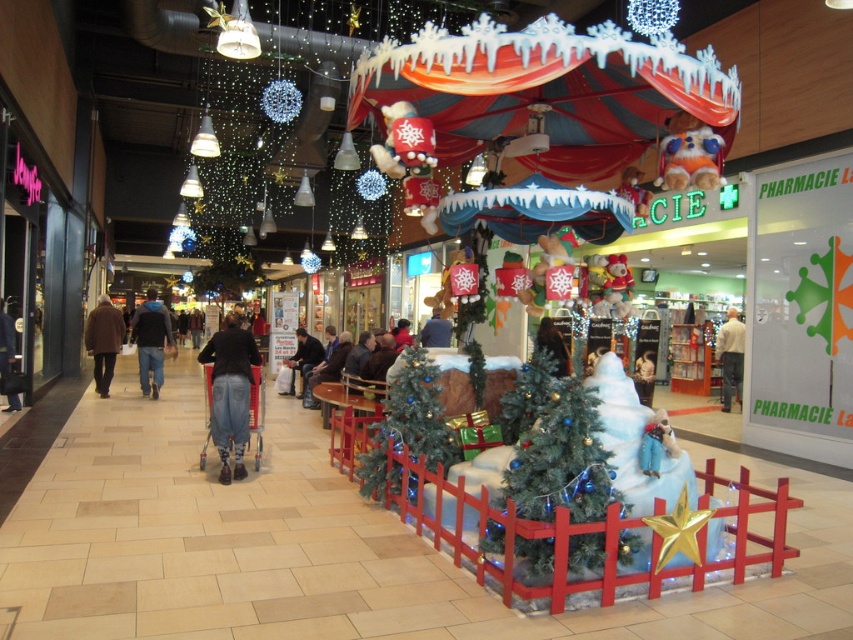
You are a customer in the mall and see both the brown wool coat at left and the white cotton shirt at center. Which clothing item is covering the other?

The brown wool coat at left is positioned over the white cotton shirt at center, so it is covering it.

You are a customer browsing the mall and see the brown wool coat at left and the white cotton shirt at center. Which item is positioned further to the left?

The brown wool coat at left is positioned further to the left compared to the white cotton shirt at center.

You are a delivery person who needs to place a package on the jeans at center. The package is 0.5 meters wide. Can you safely place it there without hitting the green matte christmas tree at center?

The green matte christmas tree at center is 6.68 meters away from the jeans at center. Since the distance is much larger than the package width, you can safely place the package on the jeans at center without hitting the tree.